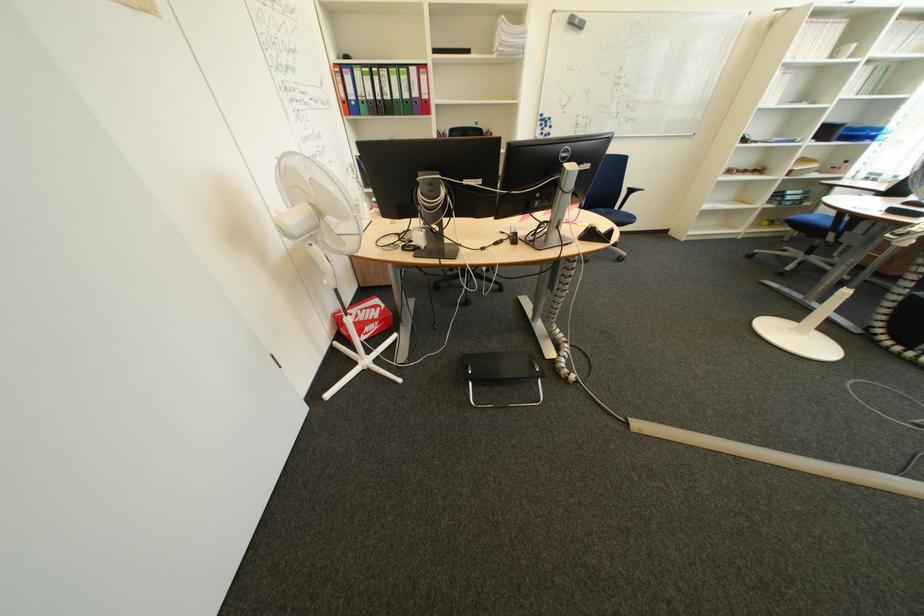
At what (x,y) coordinates should I click in order to perform the action: click on blue binder finger hole. Please return your answer as a coordinate pair (x, y). Looking at the image, I should click on (502, 371).